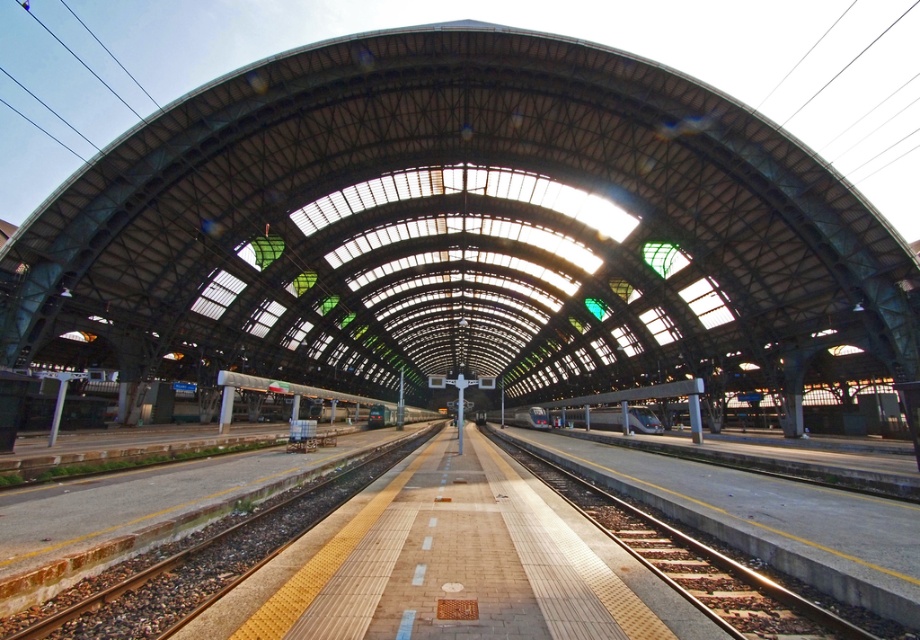
You are standing on the platform and want to take a photo of the silver metallic train at center. The brown gravel train track at center is blocking your view. Can you move around to get a clear shot without the track in the way?

The brown gravel train track at center is located above the silver metallic train at center. Since the track is above the train, moving around might allow you to position yourself below the track to capture the train without obstruction.

You are standing at the entrance of the grand railway station and want to locate the smooth concrete train track at center. According to the coordinates provided, where should you look to find it?

The smooth concrete train track at center is located at the coordinates point (692, 563).

In the scene shown: You are a passenger waiting on the platform at the grand railway station. You notice the smooth concrete train track at center and the silver metallic train at center. Which object is closer to you as you stand on the platform?

The smooth concrete train track at center is closer to you because it is in front of the silver metallic train at center, meaning the track is nearer to your position on the platform.